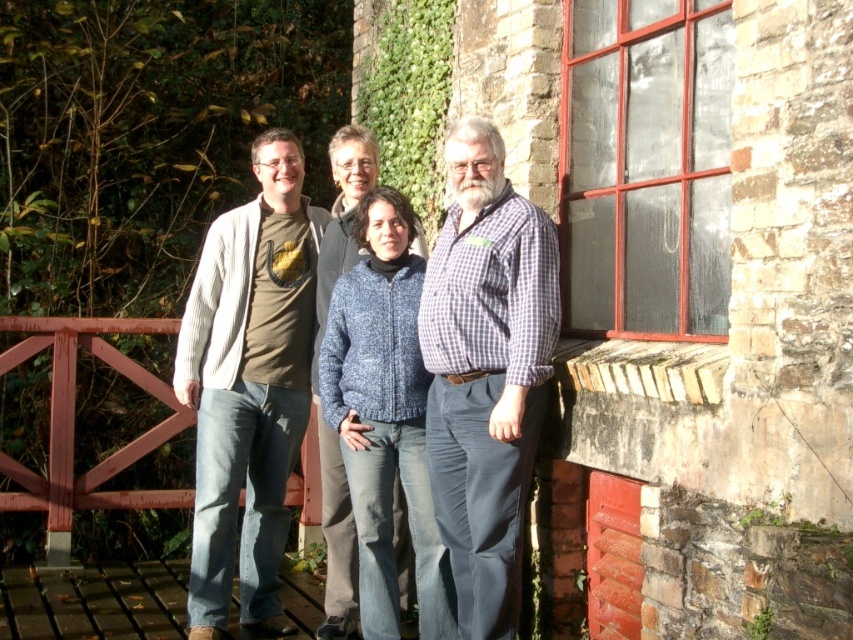
Question: Which point appears farthest from the camera in this image?

Choices:
 (A) (332, 500)
 (B) (526, 257)

Answer: (A)

Question: Does checkered fabric shirt at center have a lesser width compared to knitted blue sweater at center?

Choices:
 (A) no
 (B) yes

Answer: (A)

Question: Estimate the real-world distances between objects in this image. Which object is farther from the knitted sweater at center?

Choices:
 (A) knitted blue sweater at center
 (B) matte gray cardigan at left

Answer: (A)

Question: Does knitted sweater at center have a larger size compared to knitted blue sweater at center?

Choices:
 (A) yes
 (B) no

Answer: (A)

Question: Among these points, which one is nearest to the camera?

Choices:
 (A) (440, 506)
 (B) (260, 224)
 (C) (340, 208)

Answer: (A)

Question: Is checkered fabric shirt at center positioned in front of knitted sweater at center?

Choices:
 (A) yes
 (B) no

Answer: (A)